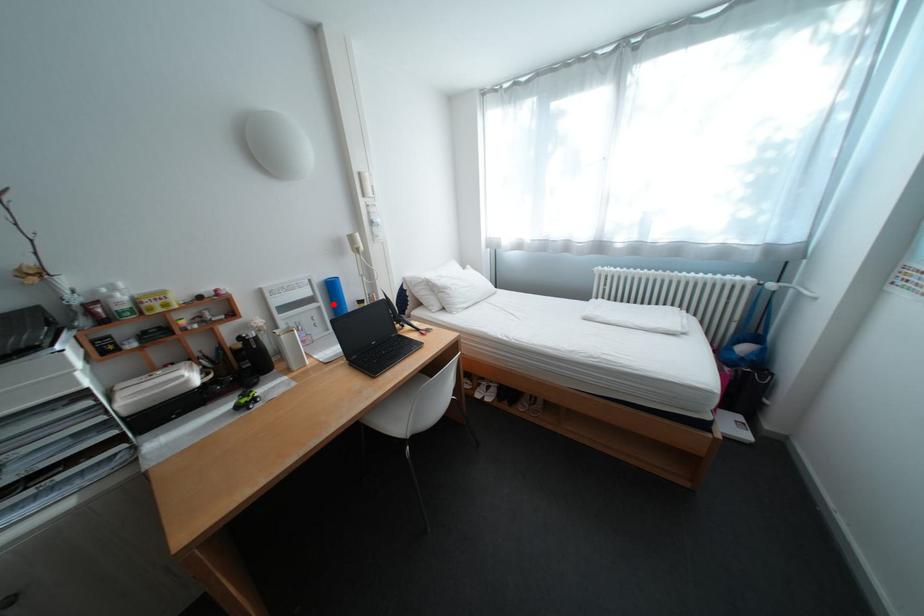
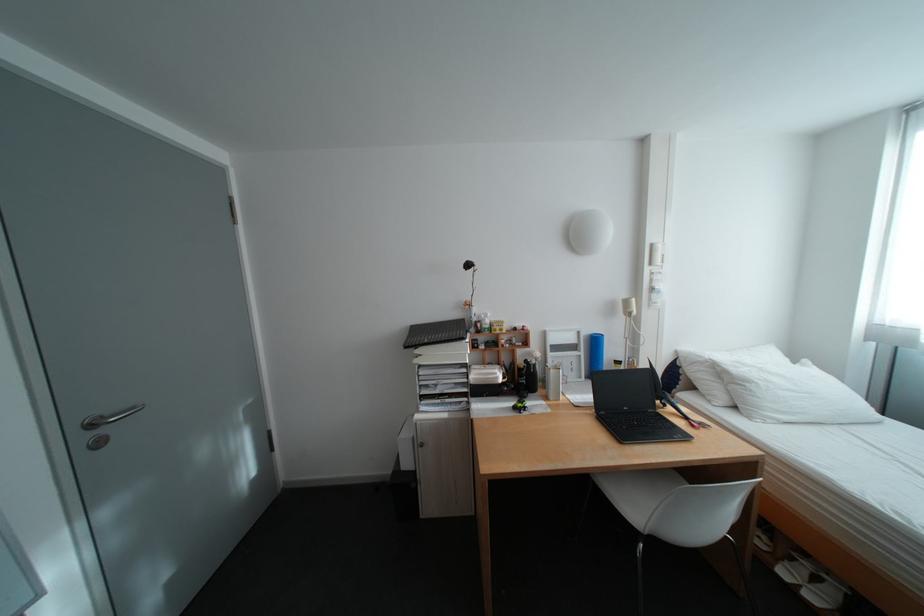
Question: I am providing you with two images of the same scene from different viewpoints. Image1 has a red point marked. In image2, the corresponding 3D location appears at what relative position? Reply with the corresponding letter.

Choices:
 (A) Closer
 (B) Farther

Answer: (B)